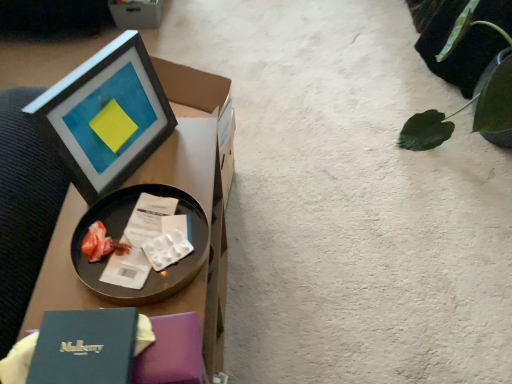
Question: Is cardboard box at upper left in front of green leafy plant at upper right?

Choices:
 (A) no
 (B) yes

Answer: (A)

Question: Can you confirm if cardboard box at upper left is positioned to the right of green leafy plant at upper right?

Choices:
 (A) no
 (B) yes

Answer: (A)

Question: Does cardboard box at upper left lie behind green leafy plant at upper right?

Choices:
 (A) yes
 (B) no

Answer: (A)

Question: Is cardboard box at upper left shorter than green leafy plant at upper right?

Choices:
 (A) no
 (B) yes

Answer: (B)

Question: From a real-world perspective, does cardboard box at upper left sit lower than green leafy plant at upper right?

Choices:
 (A) yes
 (B) no

Answer: (A)

Question: Considering the positions of green leafy plant at upper right and metallic tray at left in the image, is green leafy plant at upper right bigger or smaller than metallic tray at left?

Choices:
 (A) big
 (B) small

Answer: (A)

Question: Considering the positions of green leafy plant at upper right and metallic tray at left in the image, is green leafy plant at upper right wider or thinner than metallic tray at left?

Choices:
 (A) thin
 (B) wide

Answer: (B)

Question: Do you think green leafy plant at upper right is within metallic tray at left, or outside of it?

Choices:
 (A) outside
 (B) inside

Answer: (A)

Question: Relative to metallic tray at left, is green leafy plant at upper right in front or behind?

Choices:
 (A) behind
 (B) front

Answer: (A)

Question: From the image's perspective, is cardboard box at upper left positioned above or below black glossy tray at upper left?

Choices:
 (A) below
 (B) above

Answer: (B)

Question: Considering the positions of point [139, 9] and point [151, 160], is point [139, 9] closer or farther from the camera than point [151, 160]?

Choices:
 (A) closer
 (B) farther

Answer: (B)

Question: From a real-world perspective, relative to black glossy tray at upper left, is cardboard box at upper left vertically above or below?

Choices:
 (A) above
 (B) below

Answer: (B)

Question: In terms of width, does cardboard box at upper left look wider or thinner when compared to black glossy tray at upper left?

Choices:
 (A) thin
 (B) wide

Answer: (A)

Question: Looking at their shapes, would you say matte black picture frame at upper left is wider or thinner than green leafy plant at upper right?

Choices:
 (A) wide
 (B) thin

Answer: (B)

Question: In terms of size, does matte black picture frame at upper left appear bigger or smaller than green leafy plant at upper right?

Choices:
 (A) small
 (B) big

Answer: (A)